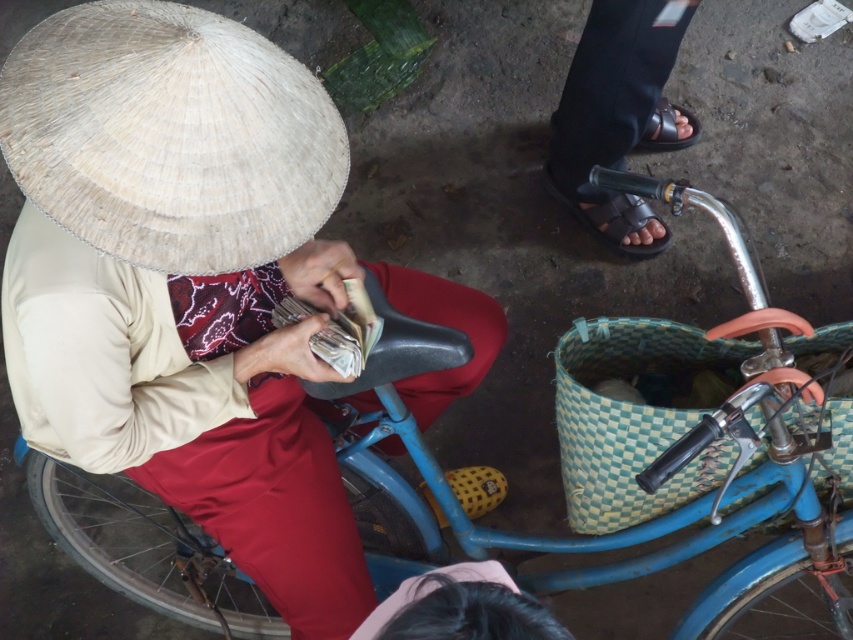
Is natural straw hat at upper left taller than green woven basket at lower right?

No, natural straw hat at upper left is not taller than green woven basket at lower right.

Can you confirm if natural straw hat at upper left is smaller than green woven basket at lower right?

Indeed, natural straw hat at upper left has a smaller size compared to green woven basket at lower right.

Describe the element at coordinates (170, 134) in the screenshot. This screenshot has height=640, width=853. I see `natural straw hat at upper left` at that location.

At what (x,y) coordinates should I click in order to perform the action: click on natural straw hat at upper left. Please return your answer as a coordinate pair (x, y). Looking at the image, I should click on (170, 134).

Is natural straw hat at upper left wider than black rubber sandal at lower right?

Indeed, natural straw hat at upper left has a greater width compared to black rubber sandal at lower right.

Find the location of a particular element. The image size is (853, 640). natural straw hat at upper left is located at coordinates (170, 134).

What do you see at coordinates (170, 134) in the screenshot?
I see `natural straw hat at upper left` at bounding box center [170, 134].

What are the coordinates of `natural straw hat at upper left` in the screenshot? It's located at (170, 134).

Can you confirm if blue matte bicycle at center is wider than black rubber sandal at lower right?

Indeed, blue matte bicycle at center has a greater width compared to black rubber sandal at lower right.

Which is in front, point (395, 576) or point (567, 198)?

Positioned in front is point (395, 576).

Find the location of a particular element. The image size is (853, 640). blue matte bicycle at center is located at coordinates (554, 538).